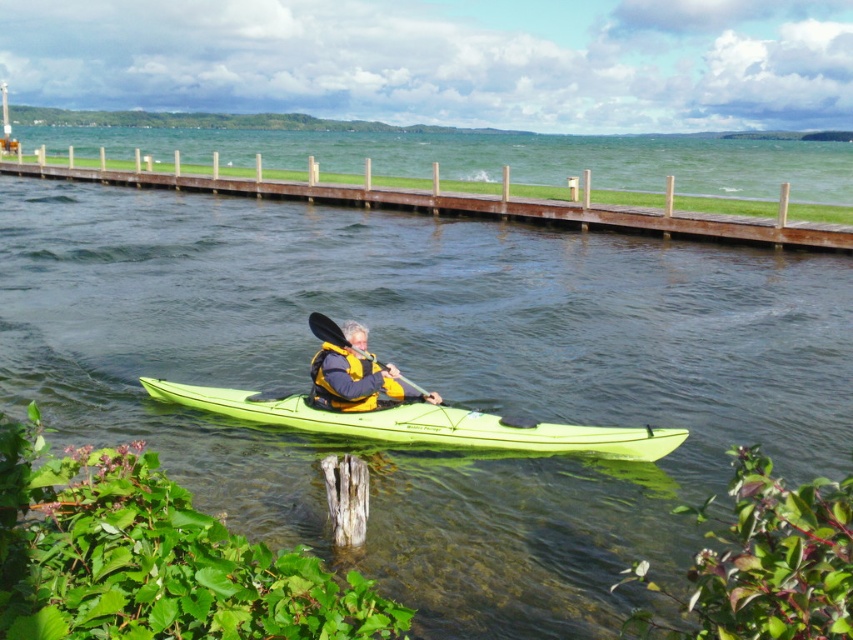
You are a photographer trying to capture the kayaker and their equipment. You notice the yellow life vest at center and the black textured paddle at center. From the kayaker perspective, which object is on the right side?

The yellow life vest at center is positioned on the right side of the black textured paddle at center, so from the kayaker perspective, the yellow life vest at center is on the right side.

You are a photographer trying to capture the brown wooden dock at upper center and the yellow life vest at center in a single shot. Given that the dock is larger than the life vest, how should you position your camera to ensure both are clearly visible in the frame?

Since the brown wooden dock at upper center is larger in size than the yellow life vest at center, position the camera closer to the yellow life vest at center to balance their sizes in the photo. This will make the dock appear smaller and the life vest larger, ensuring both are clearly visible.